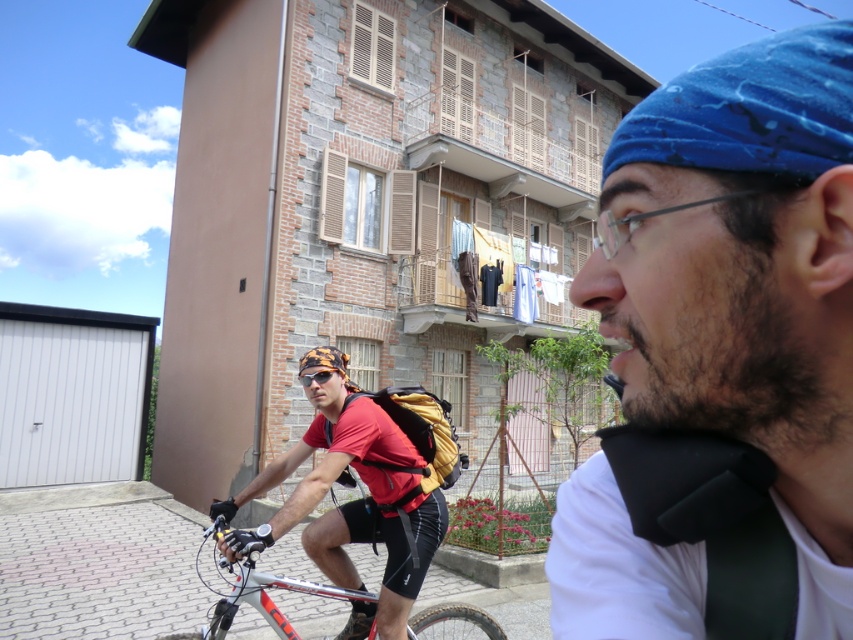
This screenshot has height=640, width=853. What do you see at coordinates (352, 502) in the screenshot?
I see `matte red shirt at center` at bounding box center [352, 502].

Measure the distance between matte red shirt at center and camera.

A distance of 2.50 meters exists between matte red shirt at center and camera.

This screenshot has height=640, width=853. Find the location of `matte red shirt at center`. matte red shirt at center is located at coordinates (352, 502).

Who is taller, blue fabric headband at upper right or shiny metallic bicycle at center?

shiny metallic bicycle at center is taller.

Does blue fabric headband at upper right come behind shiny metallic bicycle at center?

That is False.

The height and width of the screenshot is (640, 853). Identify the location of blue fabric headband at upper right. [722, 358].

Who is positioned more to the right, blue fabric headband at upper right or camouflage fabric helmet at center?

blue fabric headband at upper right is more to the right.

Does blue fabric headband at upper right have a greater width compared to camouflage fabric helmet at center?

Yes.

Who is more distant from viewer, (654,259) or (343,356)?

Positioned behind is point (343,356).

Find the location of a particular element. This screenshot has height=640, width=853. blue fabric headband at upper right is located at coordinates (722, 358).